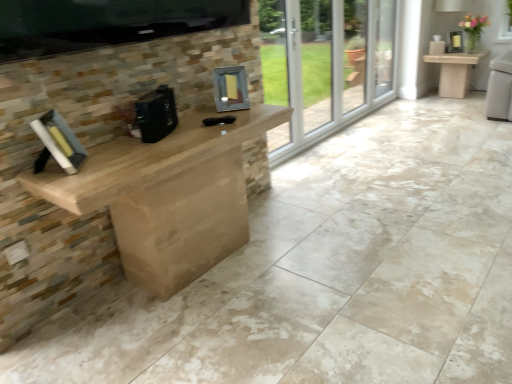
This screenshot has height=384, width=512. What are the coordinates of `vacant location below hardcover book at left (from a real-world perspective)` in the screenshot? It's located at (100, 307).